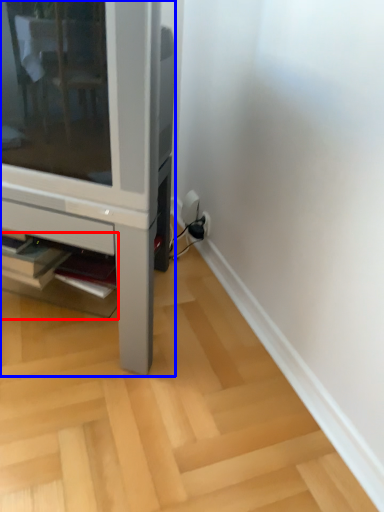
Question: Among these objects, which one is farthest to the camera, shelf (highlighted by a red box) or furniture (highlighted by a blue box)?

Choices:
 (A) shelf
 (B) furniture

Answer: (A)